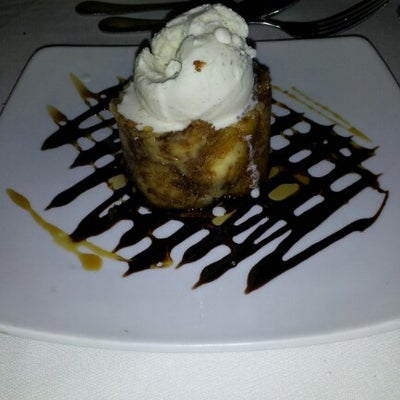
Locate an element on the screen. This screenshot has height=400, width=400. white table is located at coordinates point(50,34).